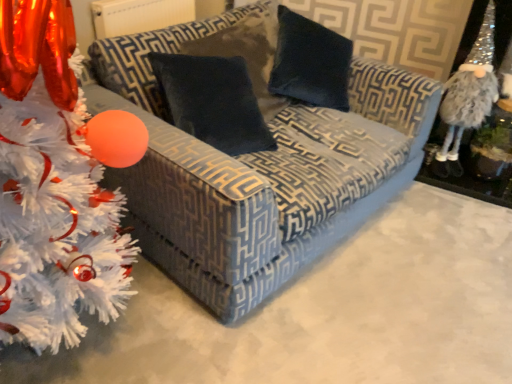
Question: Does velvet dark blue pillow at center turn towards fuzzy silver gnome at right?

Choices:
 (A) no
 (B) yes

Answer: (A)

Question: Is velvet dark blue pillow at center further to the viewer compared to fuzzy silver gnome at right?

Choices:
 (A) no
 (B) yes

Answer: (A)

Question: From the image's perspective, is velvet dark blue pillow at center on fuzzy silver gnome at right?

Choices:
 (A) yes
 (B) no

Answer: (B)

Question: From a real-world perspective, does velvet dark blue pillow at center sit lower than fuzzy silver gnome at right?

Choices:
 (A) no
 (B) yes

Answer: (A)

Question: Can you confirm if velvet dark blue pillow at center is positioned to the right of fuzzy silver gnome at right?

Choices:
 (A) yes
 (B) no

Answer: (B)

Question: Looking at the image, does fuzzy silver gnome at right seem bigger or smaller compared to white fluffy christmas tree at left?

Choices:
 (A) big
 (B) small

Answer: (B)

Question: In terms of height, does fuzzy silver gnome at right look taller or shorter compared to white fluffy christmas tree at left?

Choices:
 (A) short
 (B) tall

Answer: (A)

Question: In the image, is fuzzy silver gnome at right on the left side or the right side of white fluffy christmas tree at left?

Choices:
 (A) left
 (B) right

Answer: (B)

Question: Does point [488, 51] appear closer or farther from the camera than point [31, 23]?

Choices:
 (A) closer
 (B) farther

Answer: (B)

Question: Considering the positions of velvet dark blue pillow at center and fuzzy silver gnome at right in the image, is velvet dark blue pillow at center wider or thinner than fuzzy silver gnome at right?

Choices:
 (A) wide
 (B) thin

Answer: (A)

Question: From the image's perspective, relative to fuzzy silver gnome at right, is velvet dark blue pillow at center above or below?

Choices:
 (A) below
 (B) above

Answer: (A)

Question: In terms of height, does velvet dark blue pillow at center look taller or shorter compared to fuzzy silver gnome at right?

Choices:
 (A) short
 (B) tall

Answer: (A)

Question: Is velvet dark blue pillow at center bigger or smaller than fuzzy silver gnome at right?

Choices:
 (A) small
 (B) big

Answer: (B)

Question: Considering their positions, is velvet-patterned couch at center located in front of or behind fuzzy silver gnome at right?

Choices:
 (A) behind
 (B) front

Answer: (B)

Question: From the image's perspective, relative to fuzzy silver gnome at right, is velvet-patterned couch at center above or below?

Choices:
 (A) above
 (B) below

Answer: (B)